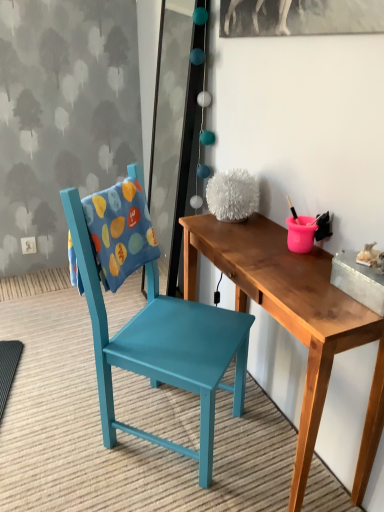
You are a GUI agent. You are given a task and a screenshot of the screen. Output one action in this format:
    pyautogui.click(x=<x>, y=<y>)
    Task: Click on the free region on the left part of wooden table at center
    
    Given the screenshot: What is the action you would take?
    pyautogui.click(x=86, y=445)